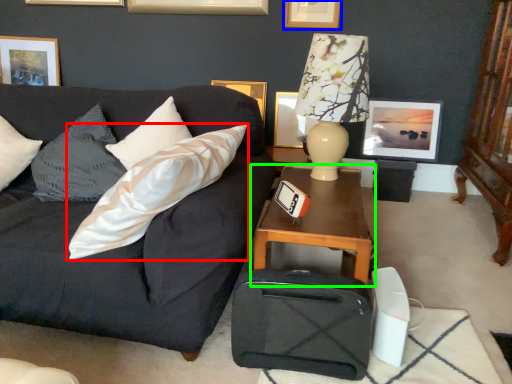
Question: Which object is positioned farthest from pillow (highlighted by a red box)? Select from picture frame (highlighted by a blue box) and table (highlighted by a green box).

Choices:
 (A) picture frame
 (B) table

Answer: (A)